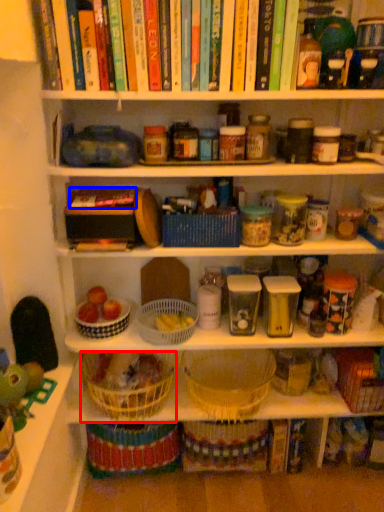
Question: Which object appears closest to the camera in this image, basket (highlighted by a red box) or book (highlighted by a blue box)?

Choices:
 (A) basket
 (B) book

Answer: (B)